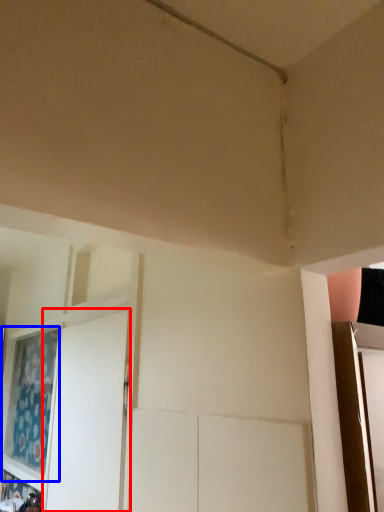
Question: Which of the following is the farthest to the observer, screen door (highlighted by a red box) or curtain (highlighted by a blue box)?

Choices:
 (A) screen door
 (B) curtain

Answer: (B)